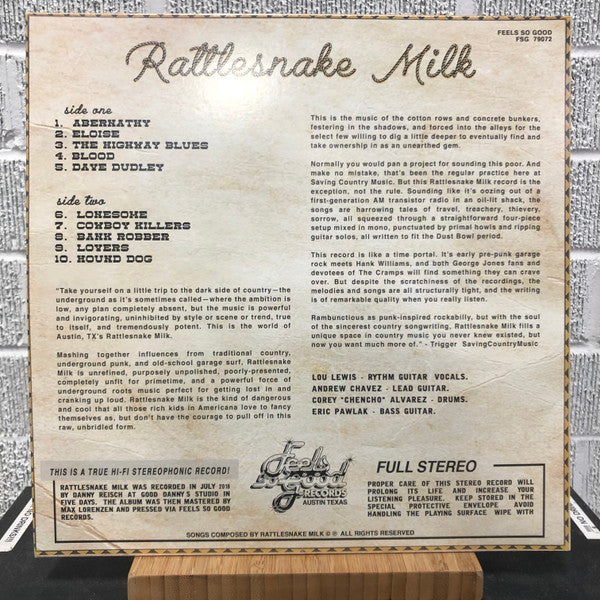
Where is `wooden mount`? wooden mount is located at coordinates (325, 560).